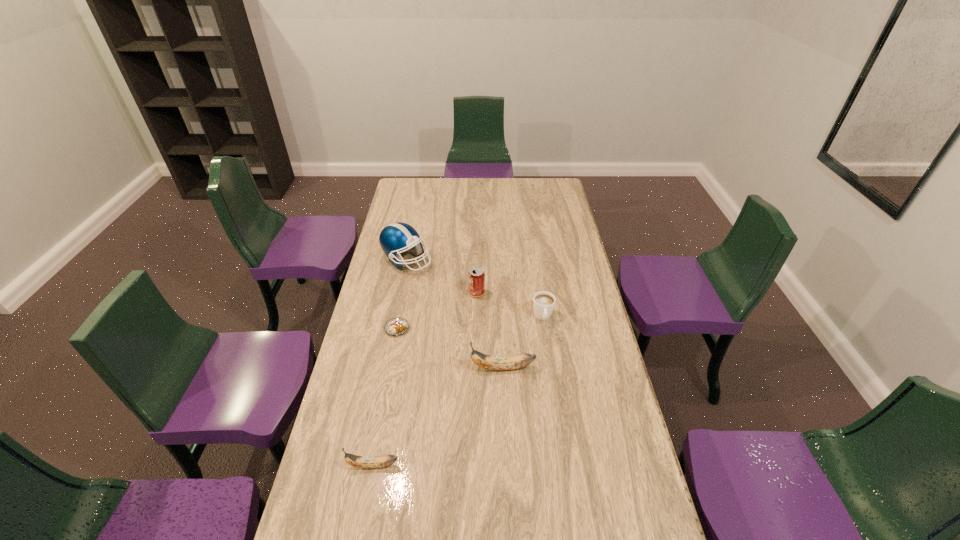
The width and height of the screenshot is (960, 540). What are the coordinates of `the nearer banana` in the screenshot? It's located at (367, 462).

Find the location of a particular element. The width and height of the screenshot is (960, 540). the left banana is located at coordinates (367, 462).

Image resolution: width=960 pixels, height=540 pixels. I want to click on the farther banana, so click(x=498, y=363).

The width and height of the screenshot is (960, 540). What are the coordinates of `the taller banana` in the screenshot? It's located at (498, 363).

Where is `soda can`? soda can is located at coordinates (476, 277).

The image size is (960, 540). In order to click on the farthest object in this screenshot , I will do `click(395, 238)`.

Identify the location of football helmet. (395, 238).

At what (x,y) coordinates should I click in order to perform the action: click on the rightmost object. Please return your answer as a coordinate pair (x, y). Looking at the image, I should click on (543, 302).

Where is `the shortest object`? The height and width of the screenshot is (540, 960). the shortest object is located at coordinates (396, 326).

I want to click on vacant space located on the peel of the taller banana, so click(407, 368).